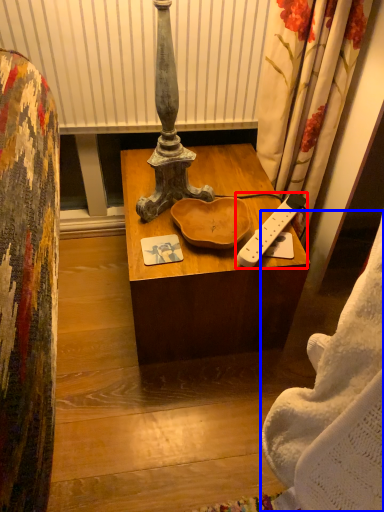
Question: Which of the following is the farthest to the observer, remote control (highlighted by a red box) or blanket (highlighted by a blue box)?

Choices:
 (A) remote control
 (B) blanket

Answer: (A)